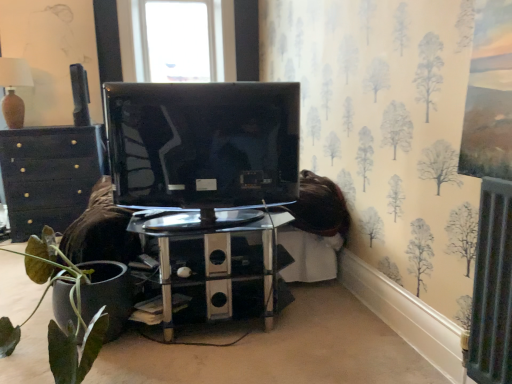
Question: Is glossy black tv at center wider than matte black chest of drawers at left?

Choices:
 (A) yes
 (B) no

Answer: (B)

Question: Considering the relative sizes of glossy black tv at center and matte black chest of drawers at left in the image provided, is glossy black tv at center bigger than matte black chest of drawers at left?

Choices:
 (A) no
 (B) yes

Answer: (A)

Question: Is glossy black tv at center turned away from matte black chest of drawers at left?

Choices:
 (A) no
 (B) yes

Answer: (A)

Question: From the image's perspective, is glossy black tv at center on top of matte black chest of drawers at left?

Choices:
 (A) yes
 (B) no

Answer: (A)

Question: Does glossy black tv at center appear on the left side of matte black chest of drawers at left?

Choices:
 (A) yes
 (B) no

Answer: (B)

Question: Would you say polished chrome table at center is inside or outside matte black chest of drawers at left?

Choices:
 (A) outside
 (B) inside

Answer: (A)

Question: Is polished chrome table at center wider or thinner than matte black chest of drawers at left?

Choices:
 (A) thin
 (B) wide

Answer: (A)

Question: From the image's perspective, is polished chrome table at center positioned above or below matte black chest of drawers at left?

Choices:
 (A) below
 (B) above

Answer: (A)

Question: From a real-world perspective, is polished chrome table at center physically located above or below matte black chest of drawers at left?

Choices:
 (A) above
 (B) below

Answer: (B)

Question: Is matte brown lampshade at upper left spatially inside glossy black tv at center, or outside of it?

Choices:
 (A) inside
 (B) outside

Answer: (B)

Question: From the image's perspective, is matte brown lampshade at upper left positioned above or below glossy black tv at center?

Choices:
 (A) above
 (B) below

Answer: (A)

Question: Relative to glossy black tv at center, is matte brown lampshade at upper left in front or behind?

Choices:
 (A) front
 (B) behind

Answer: (B)

Question: Is point (7, 105) closer or farther from the camera than point (148, 132)?

Choices:
 (A) closer
 (B) farther

Answer: (B)

Question: Considering the positions of metallic gray speaker at upper left and matte black chest of drawers at left in the image, is metallic gray speaker at upper left bigger or smaller than matte black chest of drawers at left?

Choices:
 (A) big
 (B) small

Answer: (B)

Question: Is metallic gray speaker at upper left in front of or behind matte black chest of drawers at left in the image?

Choices:
 (A) front
 (B) behind

Answer: (B)